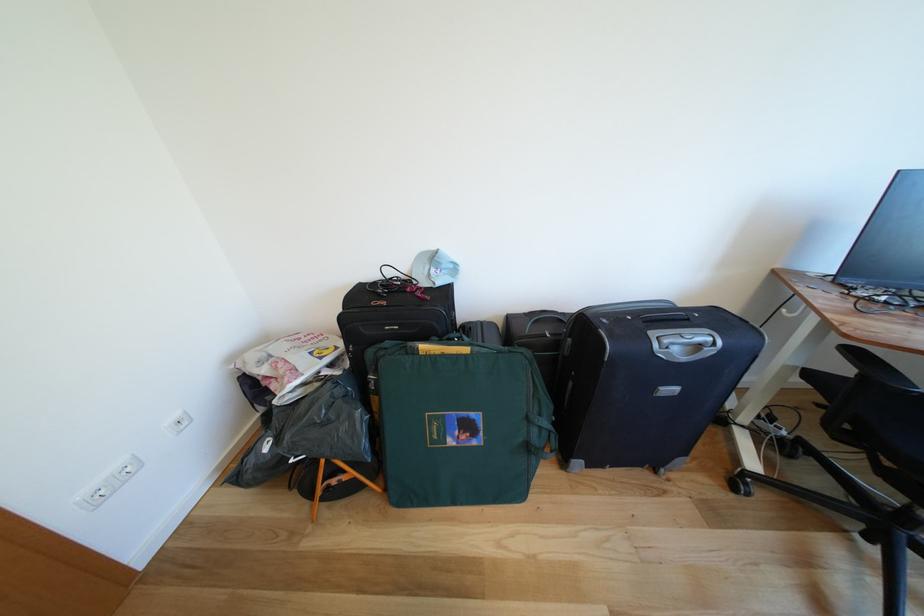
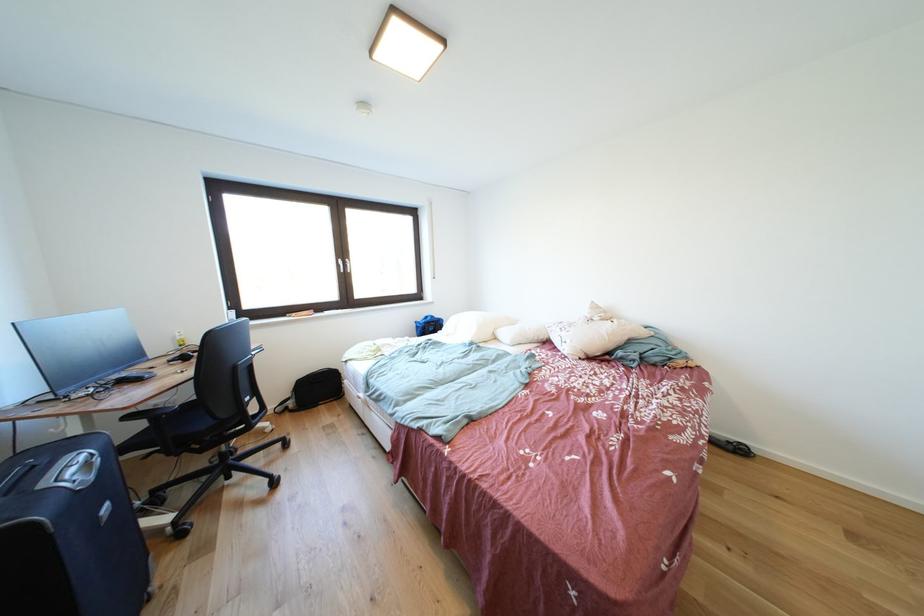
Where in the second image is the point corresponding to pixel 691 363 from the first image?

(101, 483)